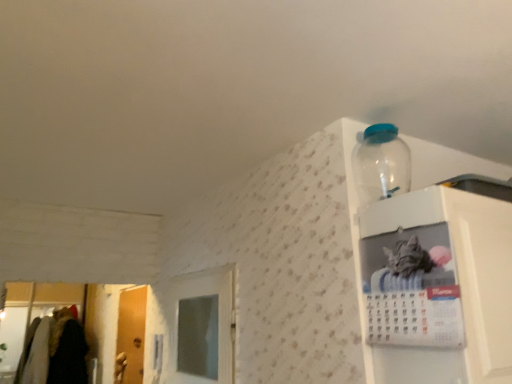
Question: From the image's perspective, is white glossy calendar at upper right, which is the second cabinet from left to right, above white glossy calendar at upper right, the 1th cabinet in the left-to-right sequence?

Choices:
 (A) yes
 (B) no

Answer: (B)

Question: Is white glossy calendar at upper right, which is the second cabinet from right to left, inside white glossy calendar at upper right, the first cabinet from the right?

Choices:
 (A) yes
 (B) no

Answer: (B)

Question: From a real-world perspective, is white glossy calendar at upper right, which is the second cabinet from left to right, positioned over white glossy calendar at upper right, the 1th cabinet in the left-to-right sequence, based on gravity?

Choices:
 (A) no
 (B) yes

Answer: (A)

Question: From a real-world perspective, is white glossy calendar at upper right, the first cabinet from the right, beneath white glossy calendar at upper right, the 1th cabinet in the left-to-right sequence?

Choices:
 (A) no
 (B) yes

Answer: (B)

Question: Does white glossy calendar at upper right, which is the second cabinet from left to right, have a lesser width compared to white glossy calendar at upper right, which is the second cabinet from right to left?

Choices:
 (A) no
 (B) yes

Answer: (A)

Question: Are white glossy calendar at upper right, the first cabinet from the right, and white glossy calendar at upper right, which is the second cabinet from right to left, far apart?

Choices:
 (A) yes
 (B) no

Answer: (B)

Question: Does transparent plastic bottle at upper right appear on the right side of wooden door at left?

Choices:
 (A) no
 (B) yes

Answer: (B)

Question: Is transparent plastic bottle at upper right completely or partially outside of wooden door at left?

Choices:
 (A) yes
 (B) no

Answer: (A)

Question: Is transparent plastic bottle at upper right at the left side of wooden door at left?

Choices:
 (A) yes
 (B) no

Answer: (B)

Question: Can you confirm if transparent plastic bottle at upper right is shorter than wooden door at left?

Choices:
 (A) no
 (B) yes

Answer: (B)

Question: Is transparent plastic bottle at upper right aimed at wooden door at left?

Choices:
 (A) yes
 (B) no

Answer: (B)

Question: Does transparent plastic bottle at upper right have a lesser width compared to wooden door at left?

Choices:
 (A) yes
 (B) no

Answer: (B)

Question: Is white glossy calendar at upper right, which is the second cabinet from left to right, positioned before wooden door at left?

Choices:
 (A) no
 (B) yes

Answer: (B)